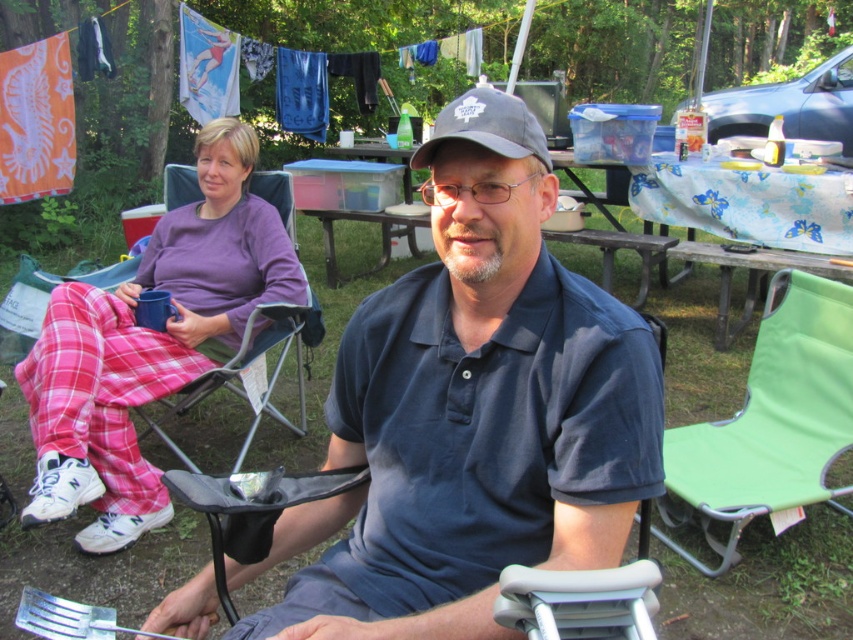
You are setting up a picnic and need to place a blanket on the blue plastic picnic table at center. However, the gray fabric baseball cap at center is already on the table. Can you still place the blanket on the table without moving the cap?

The blue plastic picnic table at center is above the gray fabric baseball cap at center, meaning the cap is currently placed on the table. Therefore, you can still place the blanket on the table, but the cap will be underneath it.

Based on the scene description, where is the dark blue cotton polo shirt at center located in terms of its 2D coordinates?

The dark blue cotton polo shirt at center is located at the 2D coordinates of point (471, 426).

Based on the scene description, if you were standing where the man in the dark blue polo shirt is sitting, which object would be closer to you between the pink plaid pants at left and the gray fabric baseball cap at center?

The pink plaid pants at left are to the left of the gray fabric baseball cap at center, so from the perspective of the man in the dark blue polo shirt, the pink plaid pants at left would be closer to him since they are positioned to the left side of the gray fabric baseball cap at center.